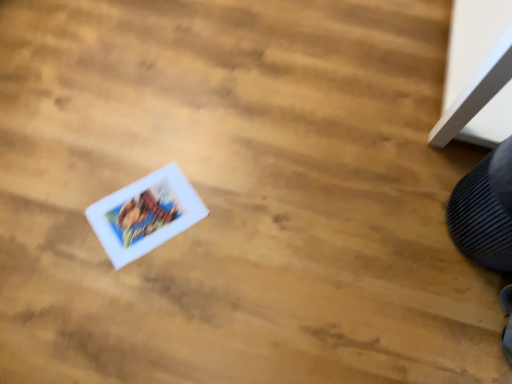
Where is `free space to the back side of black textured shoe at lower right`? free space to the back side of black textured shoe at lower right is located at coordinates (435, 148).